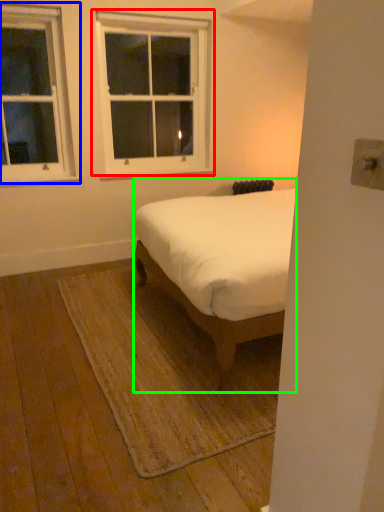
Question: Which object is the closest to the window (highlighted by a red box)? Choose among these: window (highlighted by a blue box) or bed (highlighted by a green box).

Choices:
 (A) window
 (B) bed

Answer: (A)